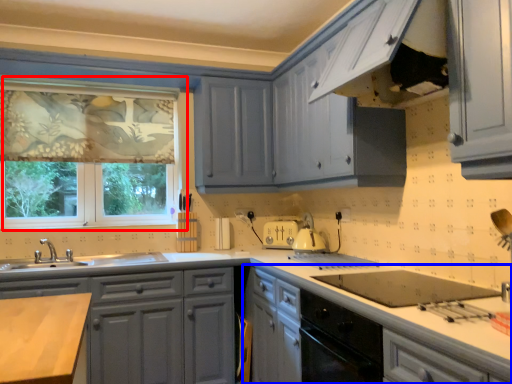
Question: Which object appears farthest to the camera in this image, window (highlighted by a red box) or cabinetry (highlighted by a blue box)?

Choices:
 (A) window
 (B) cabinetry

Answer: (A)